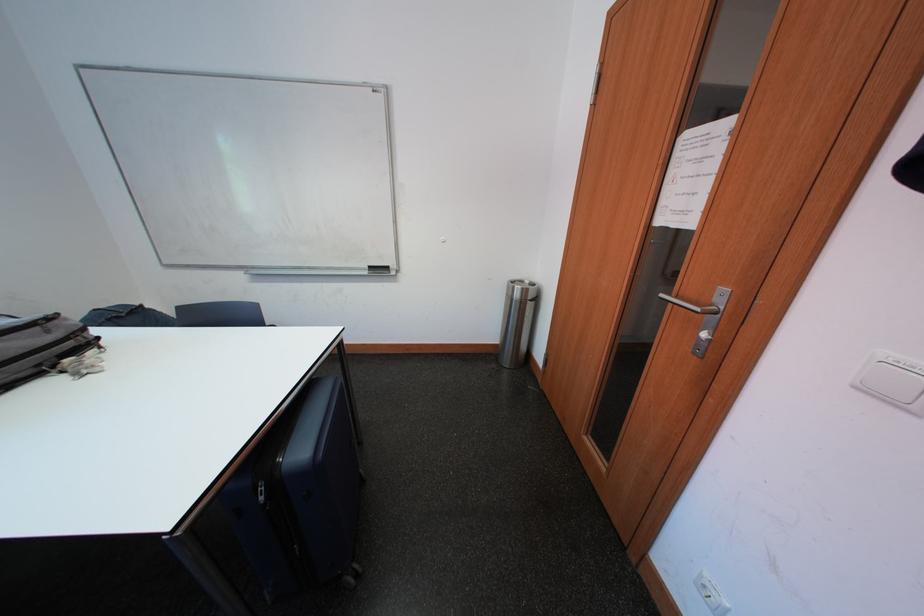
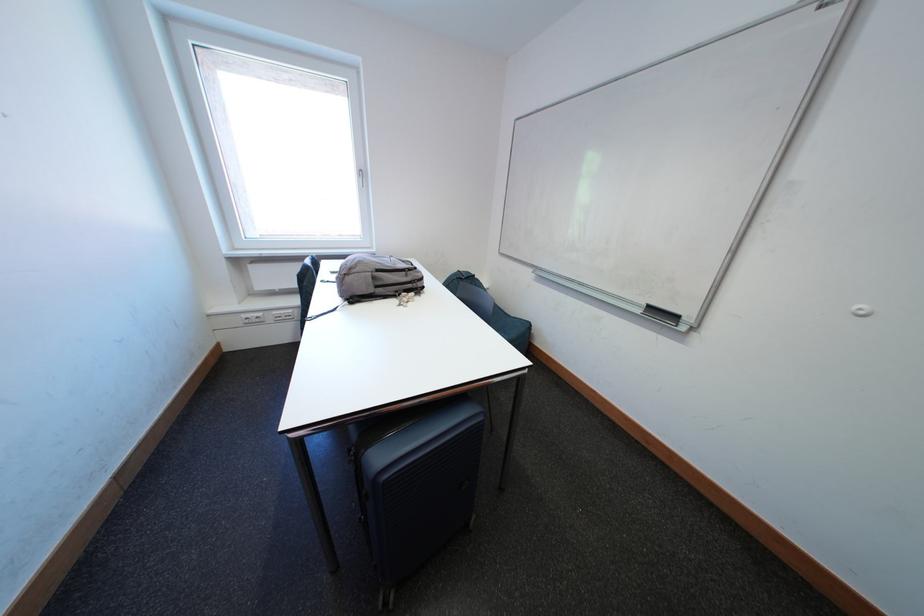
Locate, in the second image, the point that corresponds to point (49, 369) in the first image.

(406, 294)